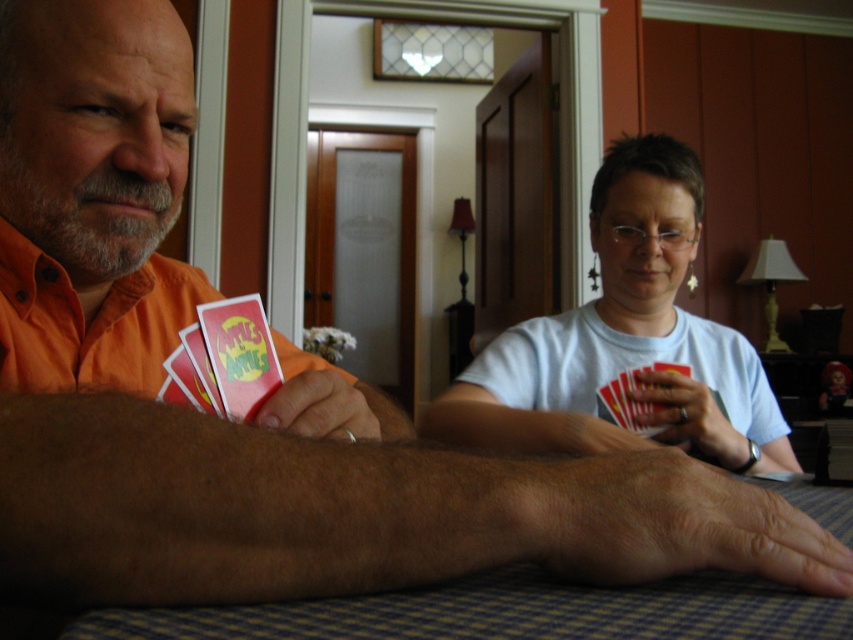
Based on the photo, is white matte t-shirt at center taller than blue checkered table at lower center?

Yes.

Is point (614, 408) more distant than point (801, 499)?

Yes, point (614, 408) is behind point (801, 499).

Where is `white matte t-shirt at center`? Image resolution: width=853 pixels, height=640 pixels. white matte t-shirt at center is located at coordinates (625, 342).